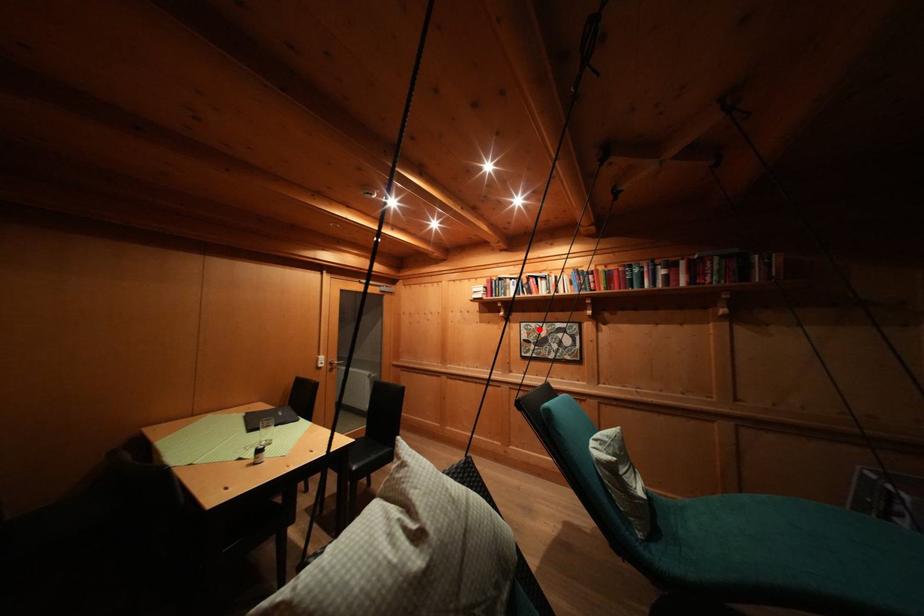
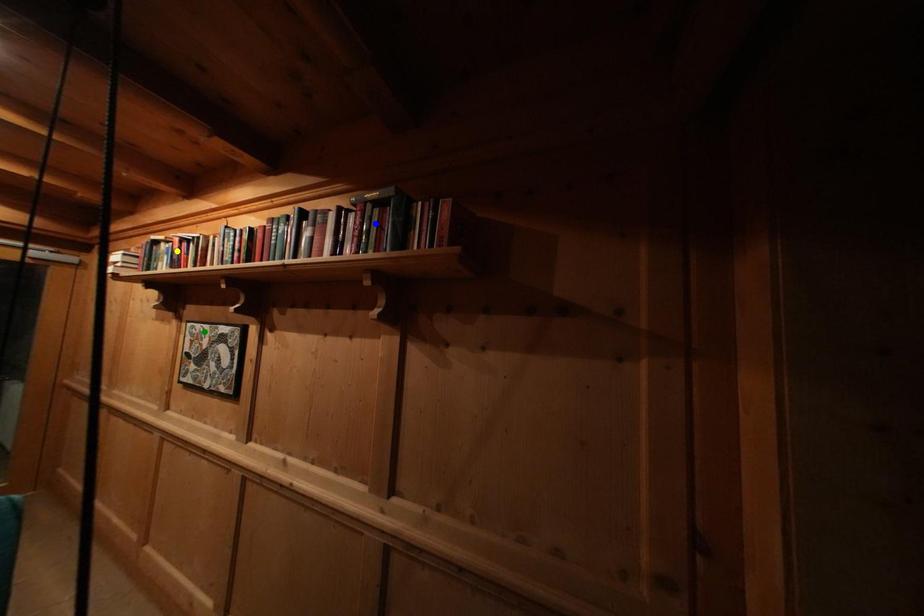
Question: I am providing you with two images of the same scene from different viewpoints. A red point is marked on the first image. You are given multiple points on the second image. In image 2, which mark is for the same physical point as the one in image 1?

Choices:
 (A) blue point
 (B) green point
 (C) yellow point

Answer: (B)